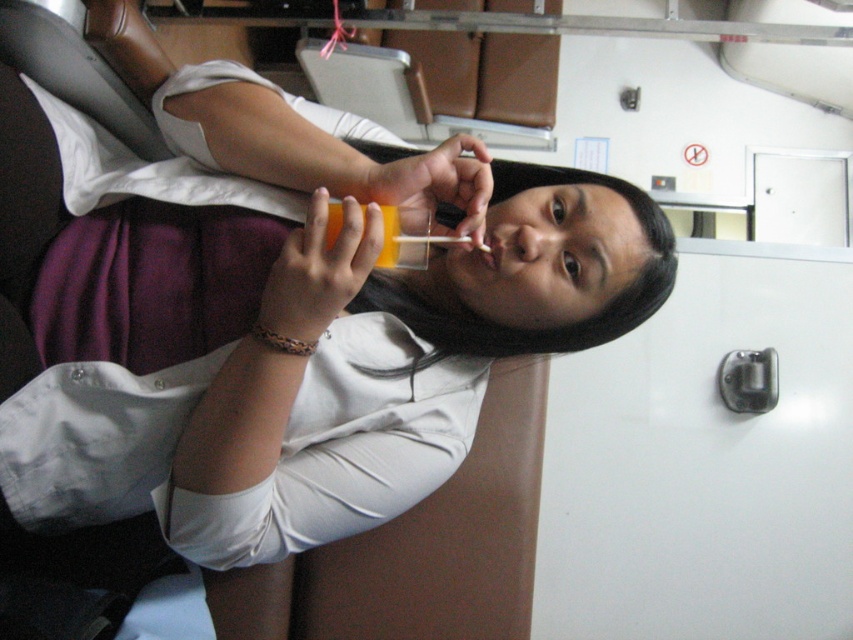
Who is positioned more to the right, multicolored woven bracelet at center or matte plastic mouth at center?

matte plastic mouth at center

Between multicolored woven bracelet at center and matte plastic mouth at center, which one appears on the left side from the viewer's perspective?

Positioned to the left is multicolored woven bracelet at center.

What do you see at coordinates (281, 340) in the screenshot? I see `multicolored woven bracelet at center` at bounding box center [281, 340].

Identify the location of multicolored woven bracelet at center. The height and width of the screenshot is (640, 853). (281, 340).

Which of these two, matte orange cup at center or multicolored woven bracelet at center, stands taller?

Standing taller between the two is matte orange cup at center.

Is matte orange cup at center bigger than multicolored woven bracelet at center?

Yes, matte orange cup at center is bigger than multicolored woven bracelet at center.

Is point (608, 225) behind point (283, 348)?

Yes, it is.

The height and width of the screenshot is (640, 853). Identify the location of matte orange cup at center. (323, 385).

Where is `matte orange cup at center`? matte orange cup at center is located at coordinates (323, 385).